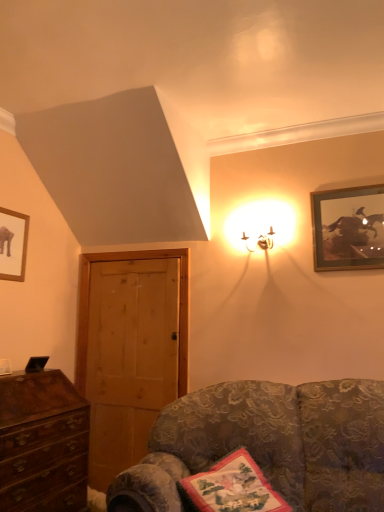
Question: Considering the relative sizes of wooden door at left and gold-framed picture at upper right, which is counted as the second picture frame, starting from the left, in the image provided, is wooden door at left thinner than gold-framed picture at upper right, which is counted as the second picture frame, starting from the left,?

Choices:
 (A) no
 (B) yes

Answer: (A)

Question: Is wooden door at left positioned beyond the bounds of gold-framed picture at upper right, which is counted as the second picture frame, starting from the left?

Choices:
 (A) yes
 (B) no

Answer: (A)

Question: From the image's perspective, is wooden door at left over gold-framed picture at upper right, which is counted as the second picture frame, starting from the left?

Choices:
 (A) no
 (B) yes

Answer: (A)

Question: Is wooden door at left positioned with its back to gold-framed picture at upper right, the 1th picture frame from the right?

Choices:
 (A) yes
 (B) no

Answer: (B)

Question: Is wooden door at left taller than gold-framed picture at upper right, the 1th picture frame from the right?

Choices:
 (A) no
 (B) yes

Answer: (B)

Question: Is gold-framed picture at upper right, which is counted as the second picture frame, starting from the left, surrounded by wooden door at left?

Choices:
 (A) yes
 (B) no

Answer: (B)

Question: Is the surface of velvet floral couch at lower right in direct contact with wooden door at left?

Choices:
 (A) no
 (B) yes

Answer: (A)

Question: Would you say velvet floral couch at lower right is outside wooden door at left?

Choices:
 (A) yes
 (B) no

Answer: (A)

Question: Considering the relative sizes of velvet floral couch at lower right and wooden door at left in the image provided, is velvet floral couch at lower right thinner than wooden door at left?

Choices:
 (A) no
 (B) yes

Answer: (A)

Question: Could wooden door at left be considered to be inside velvet floral couch at lower right?

Choices:
 (A) no
 (B) yes

Answer: (A)

Question: Could you tell me if velvet floral couch at lower right is facing wooden door at left?

Choices:
 (A) yes
 (B) no

Answer: (B)

Question: Is velvet floral couch at lower right bigger than wooden door at left?

Choices:
 (A) no
 (B) yes

Answer: (B)

Question: Is metallic gold sconce at upper right surrounded by matte black picture frame at upper left, which is the second picture frame in right-to-left order?

Choices:
 (A) no
 (B) yes

Answer: (A)